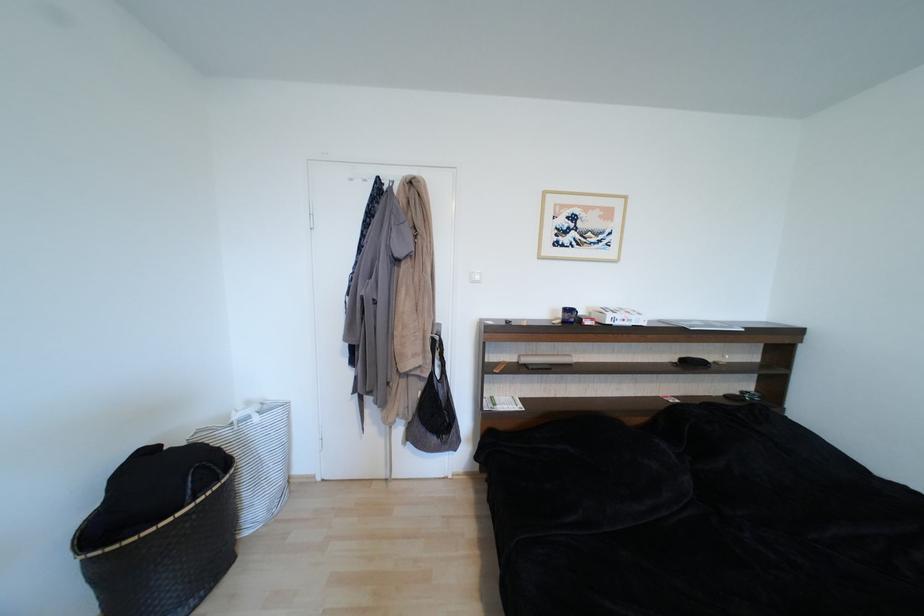
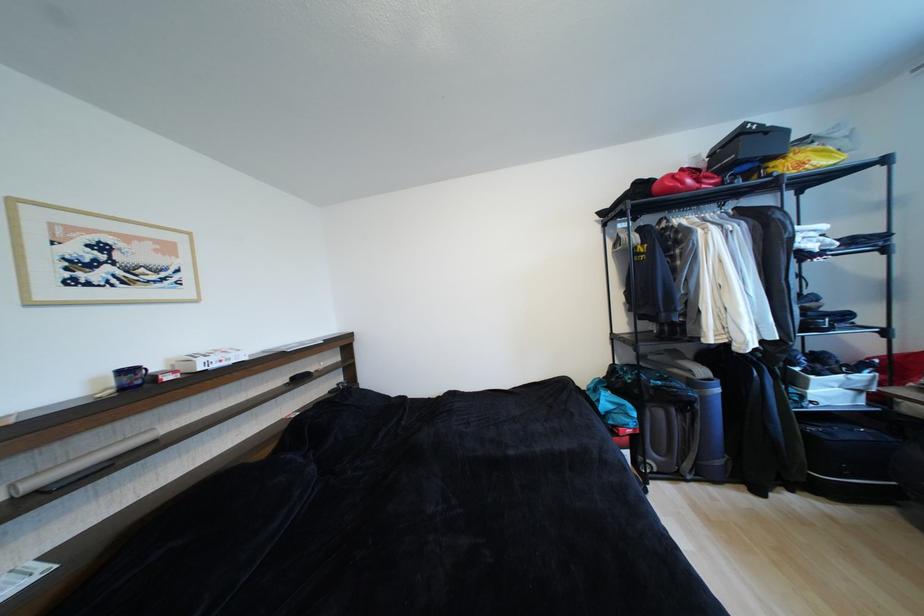
Find the pixel in the second image that matches pixel 625 317 in the first image.

(219, 360)